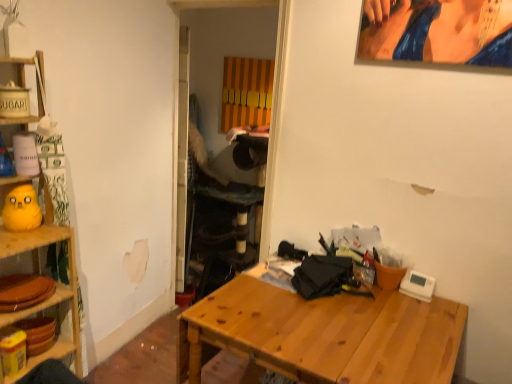
Question: In terms of height, does yellow rubber duck at left look taller or shorter compared to wooden shelf at left?

Choices:
 (A) short
 (B) tall

Answer: (A)

Question: Relative to wooden shelf at left, is yellow rubber duck at left in front or behind?

Choices:
 (A) behind
 (B) front

Answer: (A)

Question: Which object is positioned farthest from the yellow rubber duck at left?

Choices:
 (A) wooden shelf at left
 (B) wooden table at center

Answer: (B)

Question: Considering the real-world distances, which object is farthest from the wooden table at center?

Choices:
 (A) wooden shelf at left
 (B) yellow rubber duck at left

Answer: (B)